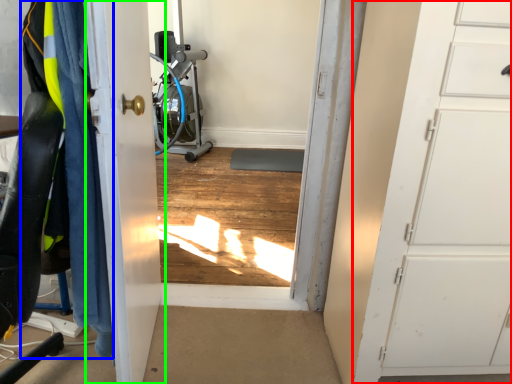
Question: Based on their relative distances, which object is nearer to door (highlighted by a red box)? Choose from clothing (highlighted by a blue box) and door (highlighted by a green box).

Choices:
 (A) clothing
 (B) door

Answer: (B)